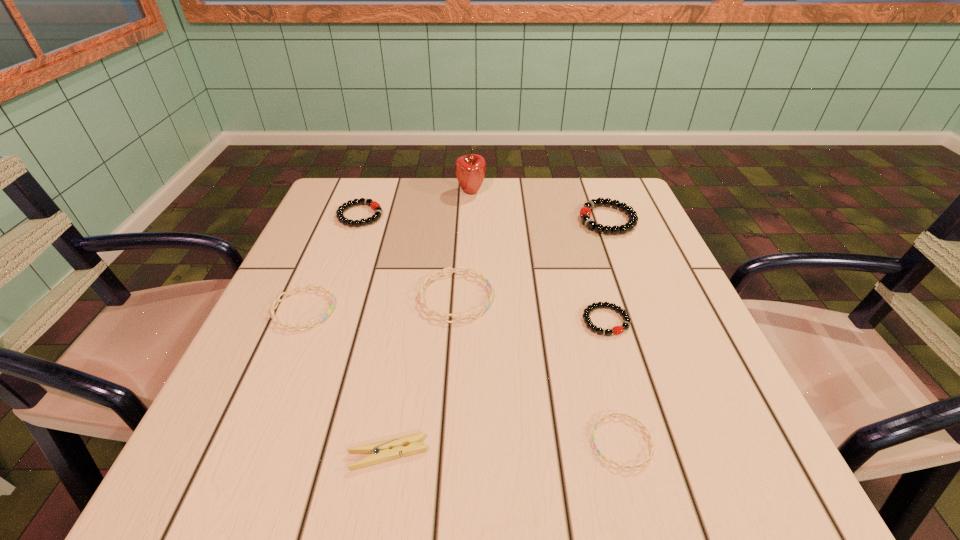
The height and width of the screenshot is (540, 960). In order to click on blue bracelet that can be found as the second closest to the shortest bracelet in this screenshot , I will do `click(278, 300)`.

You are a GUI agent. You are given a task and a screenshot of the screen. Output one action in this format:
    pyautogui.click(x=<x>, y=<y>)
    Task: Click on the free point that satisfies the following two spatial constraints: 1. on the back side of the nearest black bracelet; 2. on the surface of the second blue bracelet from right to left showing star-shaped elements
    The height and width of the screenshot is (540, 960).
    Given the screenshot: What is the action you would take?
    pyautogui.click(x=599, y=297)

This screenshot has height=540, width=960. I want to click on free space that satisfies the following two spatial constraints: 1. on the surface of the biggest blue bracelet showing star-shaped elements; 2. on the back side of the nearest black bracelet, so click(x=454, y=321).

Locate an element on the screen. blank area in the image that satisfies the following two spatial constraints: 1. on the surface of the nearest black bracelet showing star-shaped elements; 2. on the right side of the leftmost blue bracelet is located at coordinates (300, 321).